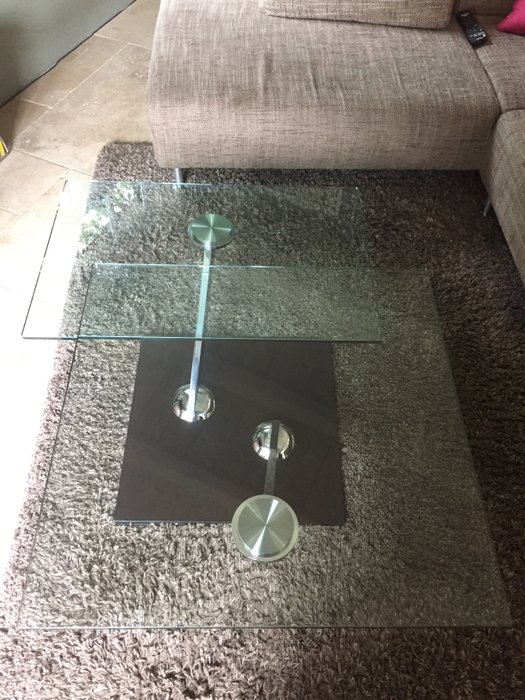
Image resolution: width=525 pixels, height=700 pixels. In order to click on lower glass table top in this screenshot , I will do `click(396, 552)`.